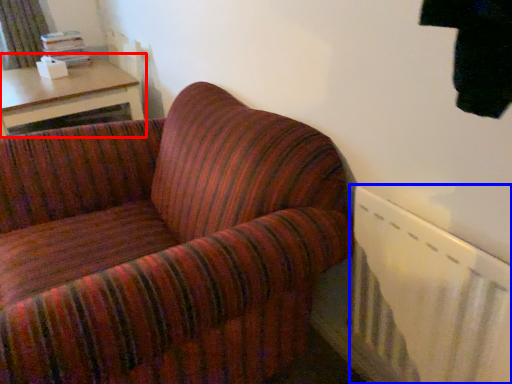
Question: Which object is further to the camera taking this photo, table (highlighted by a red box) or radiator (highlighted by a blue box)?

Choices:
 (A) table
 (B) radiator

Answer: (A)